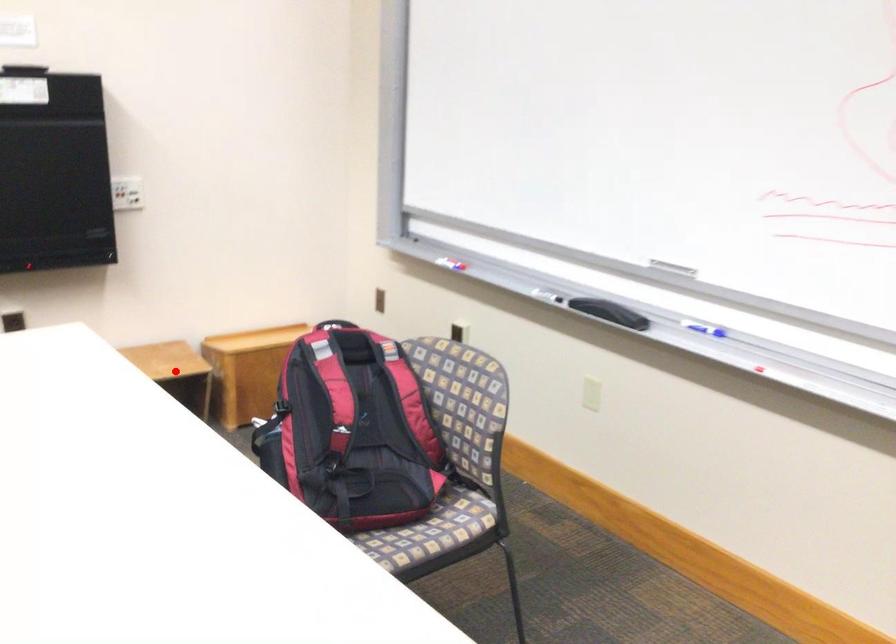
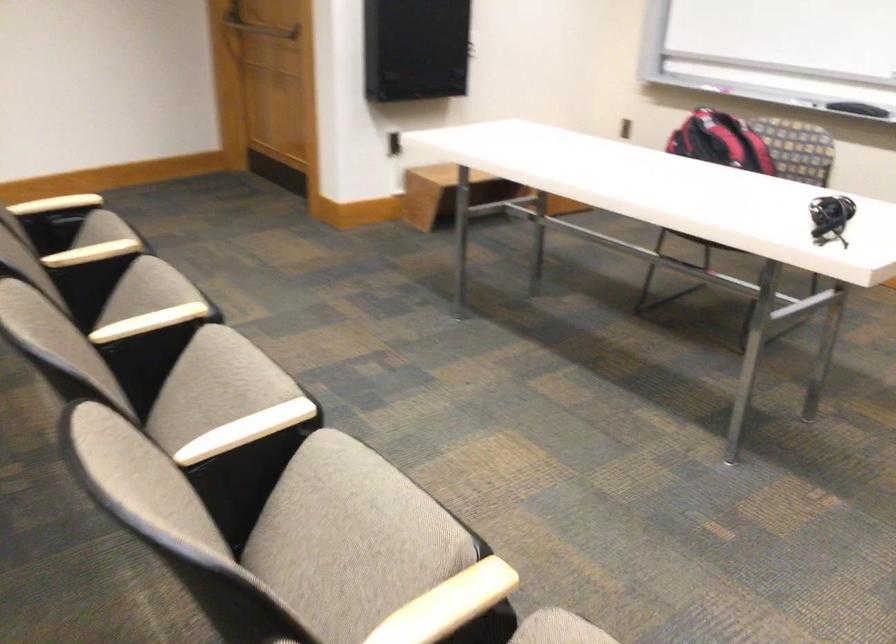
Question: I am providing you with two images of the same scene from different viewpoints. A red point is marked on the first image. Is the red point's position out of view in image 2?

Choices:
 (A) Yes
 (B) No

Answer: (A)